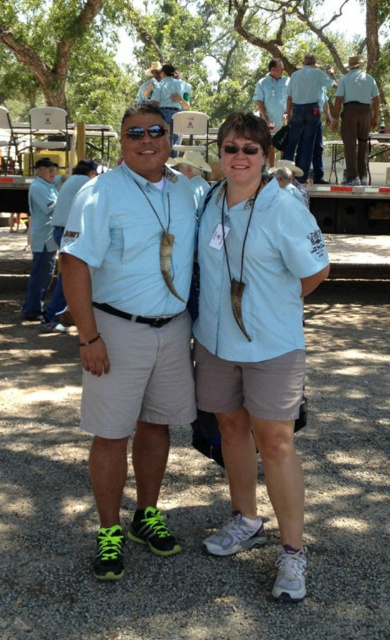
Is blue denim jeans at upper center thinner than matte black sunglasses at center?

In fact, blue denim jeans at upper center might be wider than matte black sunglasses at center.

Is blue denim jeans at upper center positioned behind matte black sunglasses at center?

Yes, blue denim jeans at upper center is behind matte black sunglasses at center.

Is point (297, 109) closer to viewer compared to point (138, 136)?

That is False.

The height and width of the screenshot is (640, 390). In order to click on blue denim jeans at upper center in this screenshot , I will do `click(303, 109)`.

The image size is (390, 640). I want to click on brown corduroy pants at upper right, so click(x=356, y=116).

Find the location of `brown corduroy pants at upper right`. brown corduroy pants at upper right is located at coordinates pos(356,116).

Can you confirm if light blue fabric shirt at center is positioned above blue shirt at upper center?

Incorrect, light blue fabric shirt at center is not positioned above blue shirt at upper center.

In the scene shown: Can you confirm if light blue fabric shirt at center is positioned to the left of blue shirt at upper center?

Correct, you'll find light blue fabric shirt at center to the left of blue shirt at upper center.

Does point (292, 577) come in front of point (278, 81)?

Yes, point (292, 577) is in front of point (278, 81).

This screenshot has height=640, width=390. What are the coordinates of `light blue fabric shirt at center` in the screenshot? It's located at (255, 339).